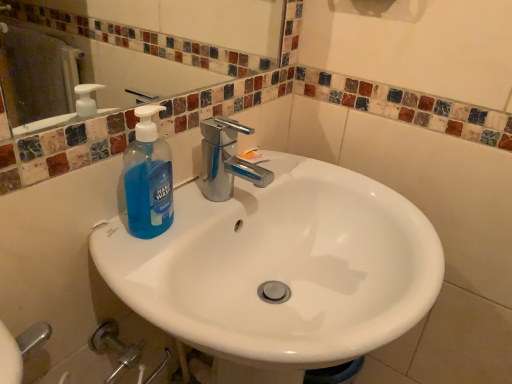
Question: Relative to white glossy sink at center, is blue translucent hand wash at upper left in front or behind?

Choices:
 (A) behind
 (B) front

Answer: (A)

Question: Based on their sizes in the image, would you say blue translucent hand wash at upper left is bigger or smaller than white glossy sink at center?

Choices:
 (A) small
 (B) big

Answer: (A)

Question: Is blue translucent hand wash at upper left taller or shorter than white glossy sink at center?

Choices:
 (A) tall
 (B) short

Answer: (B)

Question: Considering the positions of white glossy sink at center and blue translucent hand wash at upper left in the image, is white glossy sink at center bigger or smaller than blue translucent hand wash at upper left?

Choices:
 (A) big
 (B) small

Answer: (A)

Question: Is point (170, 331) closer or farther from the camera than point (167, 182)?

Choices:
 (A) farther
 (B) closer

Answer: (B)

Question: From a real-world perspective, is white glossy sink at center physically located above or below blue translucent hand wash at upper left?

Choices:
 (A) above
 (B) below

Answer: (B)

Question: In terms of height, does white glossy sink at center look taller or shorter compared to blue translucent hand wash at upper left?

Choices:
 (A) short
 (B) tall

Answer: (B)